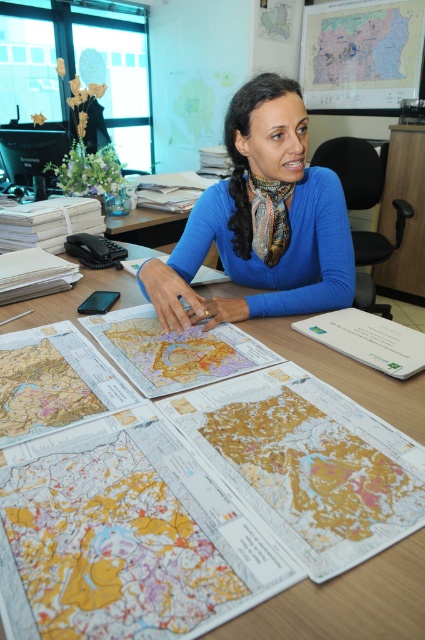
Question: Can you confirm if blue silk scarf at center is wider than paper maps at center?

Choices:
 (A) no
 (B) yes

Answer: (A)

Question: Does blue silk scarf at center have a lesser width compared to paper maps at center?

Choices:
 (A) yes
 (B) no

Answer: (A)

Question: Can you confirm if blue silk scarf at center is positioned to the right of paper maps at center?

Choices:
 (A) yes
 (B) no

Answer: (A)

Question: Which point is farther from the camera taking this photo?

Choices:
 (A) tap(204, 248)
 (B) tap(413, 433)

Answer: (A)

Question: Which object is closer to the camera taking this photo?

Choices:
 (A) blue silk scarf at center
 (B) paper maps at center

Answer: (B)